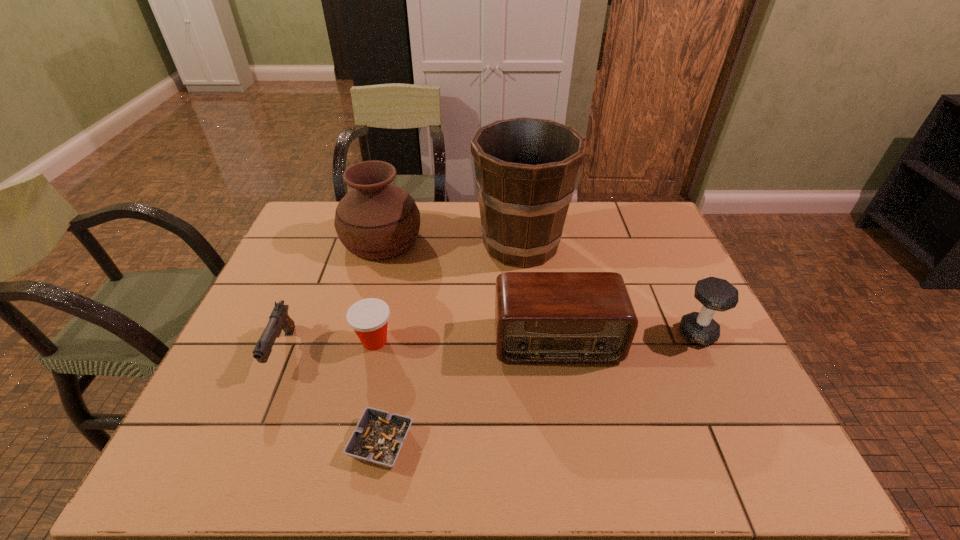
The image size is (960, 540). I want to click on free space that is in between the radio receiver and the ashtray, so click(x=469, y=392).

The height and width of the screenshot is (540, 960). I want to click on free space between the second tallest object and the radio receiver, so click(x=469, y=290).

You are a GUI agent. You are given a task and a screenshot of the screen. Output one action in this format:
    pyautogui.click(x=<x>, y=<y>)
    Task: Click on the free space that is in between the bucket and the leftmost object
    This screenshot has height=540, width=960.
    Given the screenshot: What is the action you would take?
    pyautogui.click(x=401, y=298)

Where is `empty location between the tallest object and the ashtray`? empty location between the tallest object and the ashtray is located at coordinates (451, 344).

Locate which object is the second closest to the sixth shortest object. Please provide its 2D coordinates. Your answer should be formatted as a tuple, i.e. [(x, y)], where the tuple contains the x and y coordinates of a point satisfying the conditions above.

[(279, 319)]

Where is `object that is the fourth closest to the urn`? This screenshot has height=540, width=960. object that is the fourth closest to the urn is located at coordinates (540, 317).